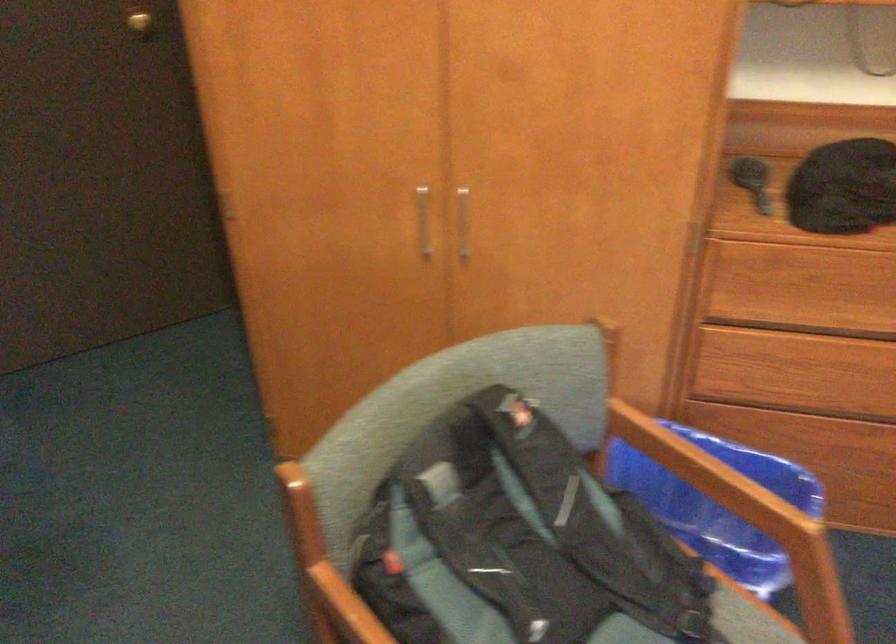
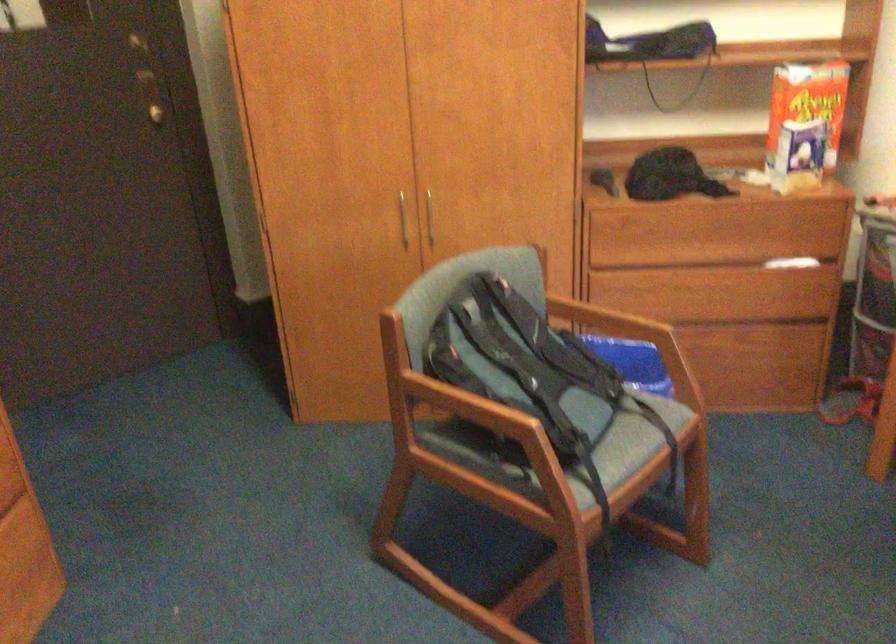
The point at (x=429, y=214) is marked in the first image. Where is the corresponding point in the second image?

(402, 220)